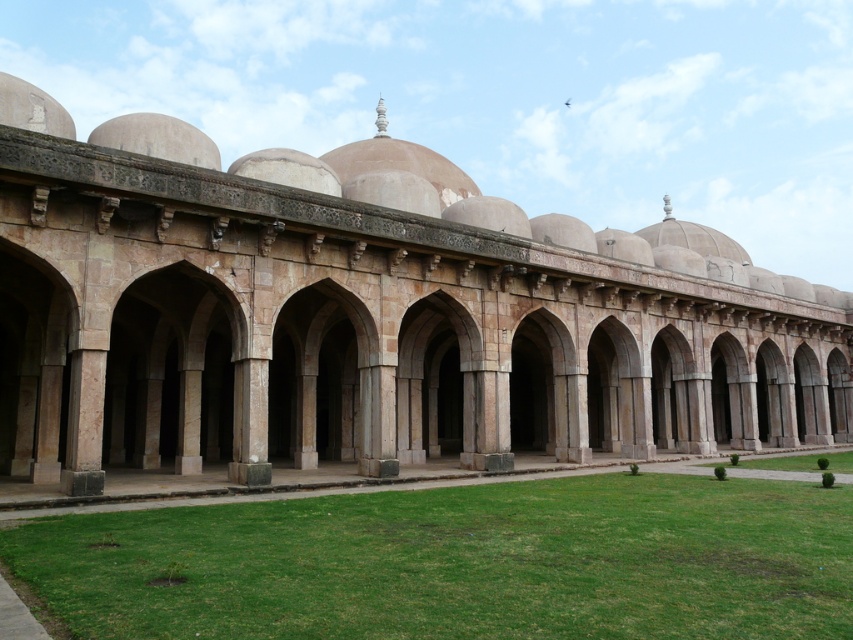
Question: Is beige stone arches at center wider than green grass at lower center?

Choices:
 (A) yes
 (B) no

Answer: (A)

Question: Is beige stone arches at center to the right of green grass at lower center from the viewer's perspective?

Choices:
 (A) no
 (B) yes

Answer: (B)

Question: Is the position of beige stone arches at center less distant than that of green grass at lower center?

Choices:
 (A) yes
 (B) no

Answer: (B)